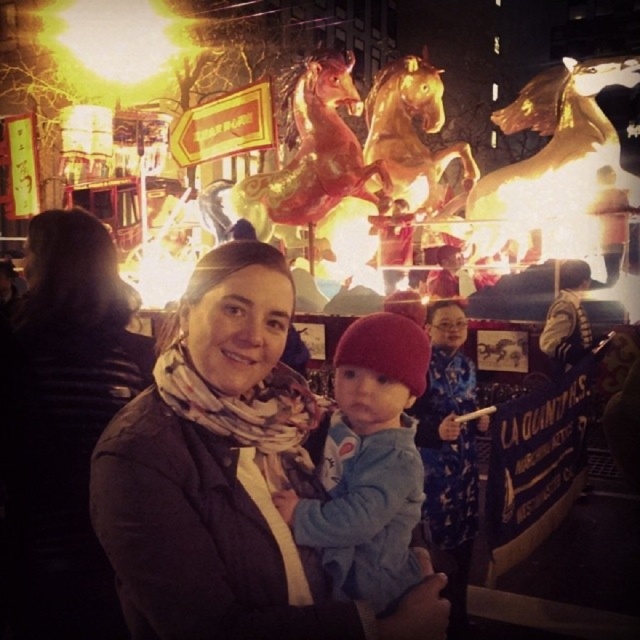
You are standing in the crowd watching the festive parade. You see two points marked in the image. The first point is at coordinate (x=232, y=573) and the second is at (x=401, y=515). Which point is closer to you?

Point (x=232, y=573) is closer to the viewer than point (x=401, y=515).